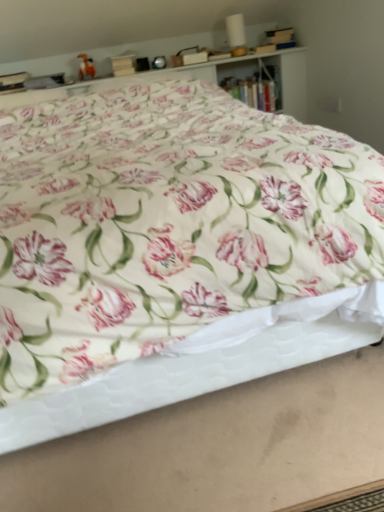
Question: Would you say wooden bookshelf at upper center contains floral fabric bed at center?

Choices:
 (A) yes
 (B) no

Answer: (B)

Question: Considering the relative sizes of wooden bookshelf at upper center and floral fabric bed at center in the image provided, is wooden bookshelf at upper center wider than floral fabric bed at center?

Choices:
 (A) no
 (B) yes

Answer: (A)

Question: Are wooden bookshelf at upper center and floral fabric bed at center far apart?

Choices:
 (A) yes
 (B) no

Answer: (A)

Question: Does wooden bookshelf at upper center have a lesser height compared to floral fabric bed at center?

Choices:
 (A) no
 (B) yes

Answer: (B)

Question: Is wooden bookshelf at upper center located outside floral fabric bed at center?

Choices:
 (A) no
 (B) yes

Answer: (B)

Question: Is wooden bookshelf at upper center taller than floral fabric bed at center?

Choices:
 (A) yes
 (B) no

Answer: (B)

Question: From a real-world perspective, is white quilted mattress at lower center over floral fabric bed at center?

Choices:
 (A) no
 (B) yes

Answer: (A)

Question: Is white quilted mattress at lower center further to camera compared to floral fabric bed at center?

Choices:
 (A) yes
 (B) no

Answer: (A)

Question: Is white quilted mattress at lower center looking in the opposite direction of floral fabric bed at center?

Choices:
 (A) no
 (B) yes

Answer: (A)

Question: Is white quilted mattress at lower center placed right next to floral fabric bed at center?

Choices:
 (A) no
 (B) yes

Answer: (A)

Question: Can we say white quilted mattress at lower center lies outside floral fabric bed at center?

Choices:
 (A) yes
 (B) no

Answer: (A)

Question: Does white quilted mattress at lower center lie in front of floral fabric bed at center?

Choices:
 (A) no
 (B) yes

Answer: (A)

Question: Can you confirm if white quilted mattress at lower center is smaller than wooden bookshelf at upper center?

Choices:
 (A) no
 (B) yes

Answer: (B)